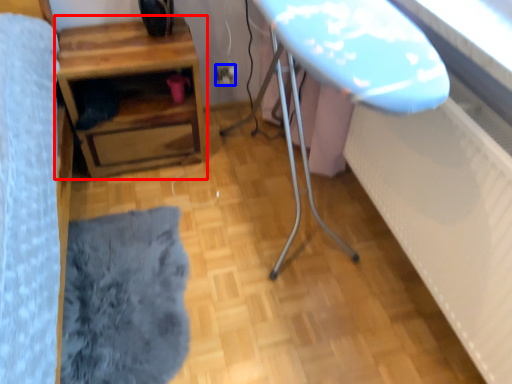
Question: Which of the following is the closest to the observer, table (highlighted by a red box) or electric outlet (highlighted by a blue box)?

Choices:
 (A) table
 (B) electric outlet

Answer: (A)